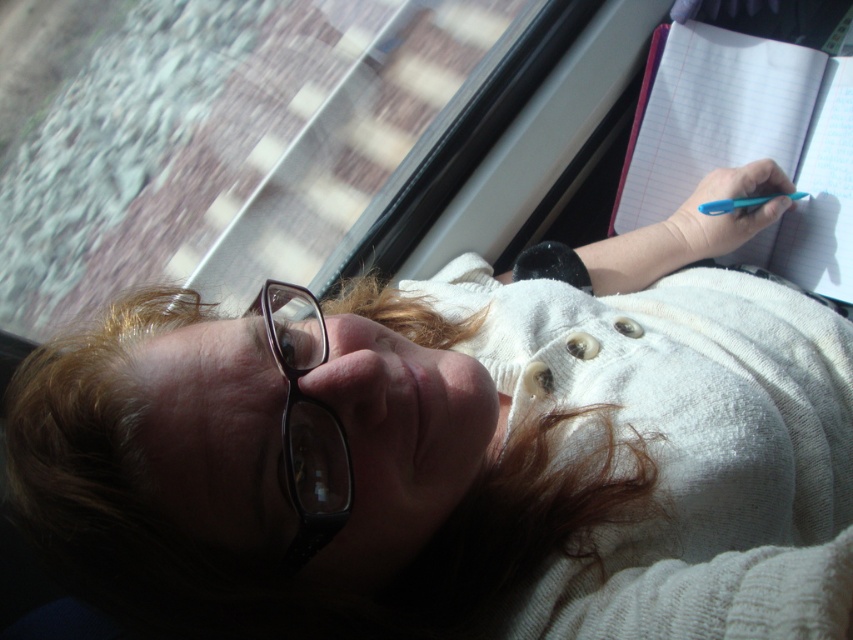
You are trying to decide which item to place in your bag first between the pink paper notebook at upper right and the black plastic glasses at lower left. Based on their sizes, which one should you put in first to optimize space?

The pink paper notebook at upper right is wider than the black plastic glasses at lower left, so you should place the pink paper notebook at upper right first to optimize space.

You are standing 5 feet away from the camera. If you walk towards the camera until you reach the point at coordinates point (680,192), will you be closer to or farther from the camera than your starting position?

The distance of point (680,192) from camera is 3.85 feet, so if you start at 5 feet away and walk to that point, you will be closer to the camera by 1.15 feet.

You are a fashion designer observing the person in the image. You need to determine if the matte white sweater at center can fit into a storage box designed for items narrower than the pink paper notebook at upper right. Can it fit?

The matte white sweater at center is wider than the pink paper notebook at upper right, so it cannot fit into the storage box designed for items narrower than the pink paper notebook at upper right.